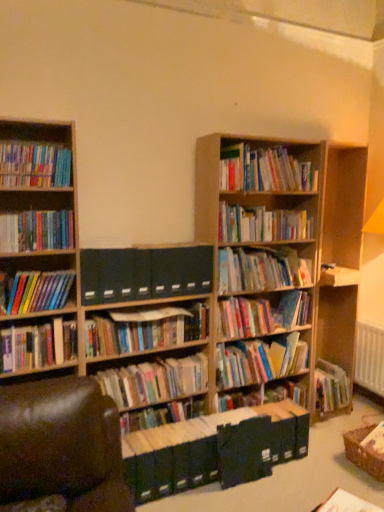
The image size is (384, 512). In order to click on hardcover books at center, which appears as the 14th book when ordered from the bottom in this screenshot , I will do `click(262, 224)`.

Image resolution: width=384 pixels, height=512 pixels. What do you see at coordinates (144, 273) in the screenshot? I see `dark blue file folders at center, the 11th book in the bottom-to-top sequence` at bounding box center [144, 273].

This screenshot has height=512, width=384. Find the location of `green matte file folders at center, the sixteenth book viewed from the top`. green matte file folders at center, the sixteenth book viewed from the top is located at coordinates (205, 449).

The height and width of the screenshot is (512, 384). What do you see at coordinates (60, 448) in the screenshot? I see `brown leather swivel chair at lower left` at bounding box center [60, 448].

Describe the element at coordinates (37, 292) in the screenshot. I see `hardcover books at left, acting as the 9th book starting from the bottom` at that location.

The image size is (384, 512). In order to click on hardcover books at center, which appears as the 14th book when ordered from the bottom in this screenshot , I will do `click(262, 224)`.

From a real-world perspective, is hardcover books at center, which appears as the 14th book when ordered from the bottom, positioned above or below hardcover books at center, which appears as the twelfth book when viewed from the top?

Clearly, from a real-world perspective, hardcover books at center, which appears as the 14th book when ordered from the bottom, is above hardcover books at center, which appears as the twelfth book when viewed from the top.

From the image's perspective, between hardcover books at center, which appears as the 3th book when viewed from the top, and hardcover books at center, acting as the 5th book starting from the bottom, which one is located above?

hardcover books at center, which appears as the 3th book when viewed from the top, appears higher in the image.

Measure the distance from hardcover books at center, which appears as the 14th book when ordered from the bottom, to hardcover books at center, acting as the 5th book starting from the bottom.

30.75 inches.

Can you confirm if hardcover books at center, which appears as the 3th book when viewed from the top, is taller than hardcover books at center, acting as the 5th book starting from the bottom?

No.

From the picture: Who is smaller, hardcover books at center, which appears as the 3th book when viewed from the top, or green matte file folders at center, the sixteenth book viewed from the top?

hardcover books at center, which appears as the 3th book when viewed from the top, is smaller.

Does point (295, 230) lie behind point (202, 435)?

Yes, point (295, 230) is farther from viewer.

Does hardcover books at center, which appears as the 14th book when ordered from the bottom, appear on the right side of green matte file folders at center, arranged as the first book when ordered from the bottom?

No, hardcover books at center, which appears as the 14th book when ordered from the bottom, is not to the right of green matte file folders at center, arranged as the first book when ordered from the bottom.

Is brown leather swivel chair at lower left positioned far away from hardcover books at left, the 11th book positioned from the top?

No, brown leather swivel chair at lower left is in close proximity to hardcover books at left, the 11th book positioned from the top.

Could hardcover books at left, the 11th book positioned from the top, be considered to be inside brown leather swivel chair at lower left?

Definitely not — hardcover books at left, the 11th book positioned from the top, is not inside brown leather swivel chair at lower left.

In the scene shown: From the image's perspective, does brown leather swivel chair at lower left appear lower than hardcover books at left, the 6th book when ordered from bottom to top?

Correct, brown leather swivel chair at lower left appears lower than hardcover books at left, the 6th book when ordered from bottom to top, in the image.

Between multicolored paperbacks at center, the 12th book ordered from the bottom, and hardcover books at left, which ranks as the 8th book in top-to-bottom order, which one has larger size?

multicolored paperbacks at center, the 12th book ordered from the bottom, is bigger.

Can you confirm if multicolored paperbacks at center, the fifth book in the top-to-bottom sequence, is positioned to the left of hardcover books at left, which ranks as the 8th book in top-to-bottom order?

Incorrect, multicolored paperbacks at center, the fifth book in the top-to-bottom sequence, is not on the left side of hardcover books at left, which ranks as the 8th book in top-to-bottom order.

From the image's perspective, which object appears higher, multicolored paperbacks at center, the fifth book in the top-to-bottom sequence, or hardcover books at left, which ranks as the 8th book in top-to-bottom order?

Result: multicolored paperbacks at center, the fifth book in the top-to-bottom sequence, from the image's perspective.

Starting from the multicolored paperbacks at center, the fifth book in the top-to-bottom sequence, which book is the 6th one in front? Please provide its 2D coordinates.

[(37, 292)]

From a real-world perspective, is dark blue file folders at center, the 11th book in the bottom-to-top sequence, on top of matte black book at center?

Yes, from a real-world perspective, dark blue file folders at center, the 11th book in the bottom-to-top sequence, is on top of matte black book at center.

From the image's perspective, is dark blue file folders at center, the 11th book in the bottom-to-top sequence, located above matte black book at center?

Yes.

Which book is the 3rd one when counting from the front of the matte black book at center? Please provide its 2D coordinates.

[(144, 273)]

Is dark blue file folders at center, the 11th book in the bottom-to-top sequence, facing towards matte black book at center?

No, dark blue file folders at center, the 11th book in the bottom-to-top sequence, does not turn towards matte black book at center.

Who is shorter, hardcover books at center, the 2th book in the bottom-to-top sequence, or green matte file folders at center, arranged as the first book when ordered from the bottom?

With less height is green matte file folders at center, arranged as the first book when ordered from the bottom.

What's the angular difference between hardcover books at center, the 2th book in the bottom-to-top sequence, and green matte file folders at center, the sixteenth book viewed from the top,'s facing directions?

90.1 degrees.

Would you consider hardcover books at center, the 15th book in the top-to-bottom sequence, to be distant from green matte file folders at center, the sixteenth book viewed from the top?

hardcover books at center, the 15th book in the top-to-bottom sequence, is actually quite close to green matte file folders at center, the sixteenth book viewed from the top.

Locate an element on the screen. book beneath the hardcover books at center, the 2th book in the bottom-to-top sequence (from a real-world perspective) is located at coordinates (205, 449).

Consider the image. Is hardcover book at upper right, the 10th book from the bottom, shorter than brown leather swivel chair at lower left?

Yes, hardcover book at upper right, the 10th book from the bottom, is shorter than brown leather swivel chair at lower left.

Considering the relative positions of hardcover book at upper right, the 10th book from the bottom, and brown leather swivel chair at lower left in the image provided, is hardcover book at upper right, the 10th book from the bottom, to the left of brown leather swivel chair at lower left from the viewer's perspective?

No, hardcover book at upper right, the 10th book from the bottom, is not to the left of brown leather swivel chair at lower left.

How different are the orientations of hardcover book at upper right, arranged as the seventh book when viewed from the top, and brown leather swivel chair at lower left in degrees?

hardcover book at upper right, arranged as the seventh book when viewed from the top, and brown leather swivel chair at lower left are facing 10.4 degrees away from each other.

Which object is more forward, hardcover book at upper right, arranged as the seventh book when viewed from the top, or brown leather swivel chair at lower left?

brown leather swivel chair at lower left is closer to the camera.

I want to click on the 9th book directly beneath the hardcover books at center, which appears as the 14th book when ordered from the bottom (from a real-world perspective), so (260, 361).

From the hardcover books at center, which appears as the 14th book when ordered from the bottom, count 10th books forward and point to it. Please provide its 2D coordinates.

[(205, 449)]

When comparing their distances from green matte file folders at center, the sixteenth book viewed from the top, does hardcover books at left, the 6th book when ordered from bottom to top, or dark blue file folders at center, positioned as the sixth book in top-to-bottom order, seem closer?

hardcover books at left, the 6th book when ordered from bottom to top.

Estimate the real-world distances between objects in this image. Which object is closer to hardcover books at left, the 6th book when ordered from bottom to top, white paper at lower right, which is the third book in bottom-to-top order, or matte black book at center?

matte black book at center lies closer to hardcover books at left, the 6th book when ordered from bottom to top, than the other object.

Which object lies further to the anchor point hardcover books at center, which appears as the twelfth book when viewed from the top, hardcover books at center, the ninth book in the top-to-bottom sequence, or hardcover books at left, acting as the 9th book starting from the bottom?

Based on the image, hardcover books at left, acting as the 9th book starting from the bottom, appears to be further to hardcover books at center, which appears as the twelfth book when viewed from the top.

From the image, which object appears to be farther from hardcover book at upper right, arranged as the seventh book when viewed from the top, hardcover books at center, acting as the 8th book starting from the bottom, or white plastic radiator at right?

white plastic radiator at right lies further to hardcover book at upper right, arranged as the seventh book when viewed from the top, than the other object.

Based on their spatial positions, is white paper at lower right, acting as the fourteenth book starting from the top, or white plastic radiator at right further from hardcover books at center, acting as the 5th book starting from the bottom?

white paper at lower right, acting as the fourteenth book starting from the top, lies further to hardcover books at center, acting as the 5th book starting from the bottom, than the other object.

Considering their positions, is white plastic radiator at right positioned closer to hardcover books at center, the ninth book in the top-to-bottom sequence, than hardcover books at center, acting as the 5th book starting from the bottom?

hardcover books at center, acting as the 5th book starting from the bottom.

Looking at the image, which one is located closer to white plastic radiator at right, hardcover books at upper left, the fifteenth book when ordered from bottom to top, or dark blue file folders at center, the 11th book in the bottom-to-top sequence?

The object closer to white plastic radiator at right is dark blue file folders at center, the 11th book in the bottom-to-top sequence.

Which object lies further to the anchor point white plastic radiator at right, hardcover book at upper right, the 10th book from the bottom, or hardcover books at left, the 6th book when ordered from bottom to top?

hardcover books at left, the 6th book when ordered from bottom to top.

Image resolution: width=384 pixels, height=512 pixels. In order to click on paperback book positioned between white paper at lower right, acting as the fourteenth book starting from the top, and hardcover book at upper right, the 10th book from the bottom, from near to far in this screenshot , I will do `click(244, 451)`.

Find the location of a particular element. Image resolution: width=384 pixels, height=512 pixels. bookcase that lies between hardcover books at upper center, which ranks as the first book in top-to-bottom order, and hardcover books at center, the 15th book in the top-to-bottom sequence, from top to bottom is located at coordinates click(x=242, y=291).

This screenshot has height=512, width=384. I want to click on paperback book located between hardcover books at center, placed as the 13th book when sorted from top to bottom, and white plastic radiator at right in the left-right direction, so click(x=244, y=451).

Locate an element on the screen. bookcase between hardcover books at center, which appears as the 14th book when ordered from the bottom, and hardcover books at center, the 2th book in the bottom-to-top sequence, in the up-down direction is located at coordinates [x=242, y=291].